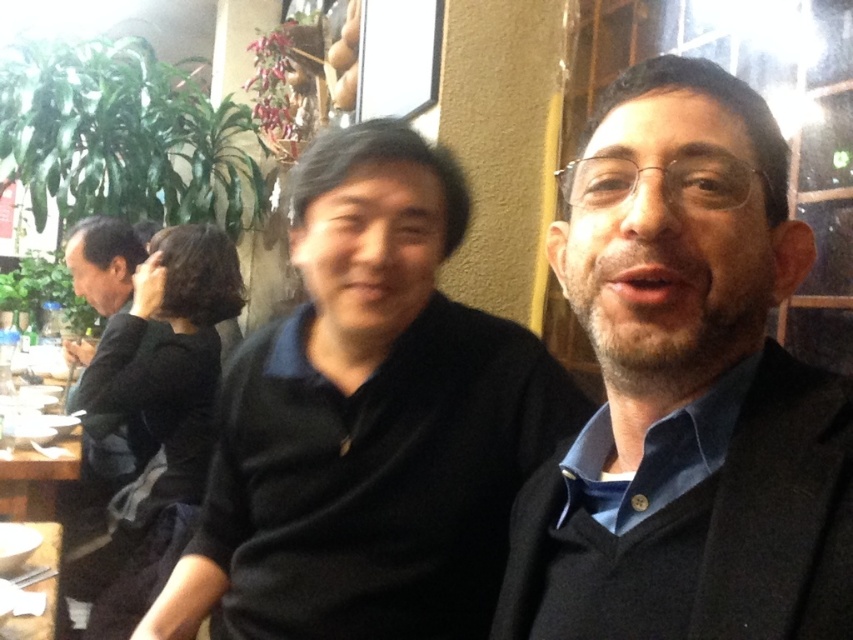
Is the position of dark blue sweater at center more distant than that of wooden table at lower left?

No.

Between point (695, 268) and point (48, 596), which one is positioned behind?

Point (48, 596)

Image resolution: width=853 pixels, height=640 pixels. I want to click on dark blue sweater at center, so click(688, 396).

What do you see at coordinates (36, 480) in the screenshot? I see `white glossy table at lower left` at bounding box center [36, 480].

Who is positioned more to the left, white glossy table at lower left or wooden table at lower left?

white glossy table at lower left is more to the left.

Measure the distance between point (68, 472) and camera.

The distance of point (68, 472) from camera is 5.72 feet.

The image size is (853, 640). In order to click on white glossy table at lower left in this screenshot , I will do click(x=36, y=480).

From the picture: Is dark blue sweater at center to the right of white glossy table at lower left from the viewer's perspective?

Yes, dark blue sweater at center is to the right of white glossy table at lower left.

Does dark blue sweater at center appear under white glossy table at lower left?

No, dark blue sweater at center is not below white glossy table at lower left.

The image size is (853, 640). I want to click on dark blue sweater at center, so click(688, 396).